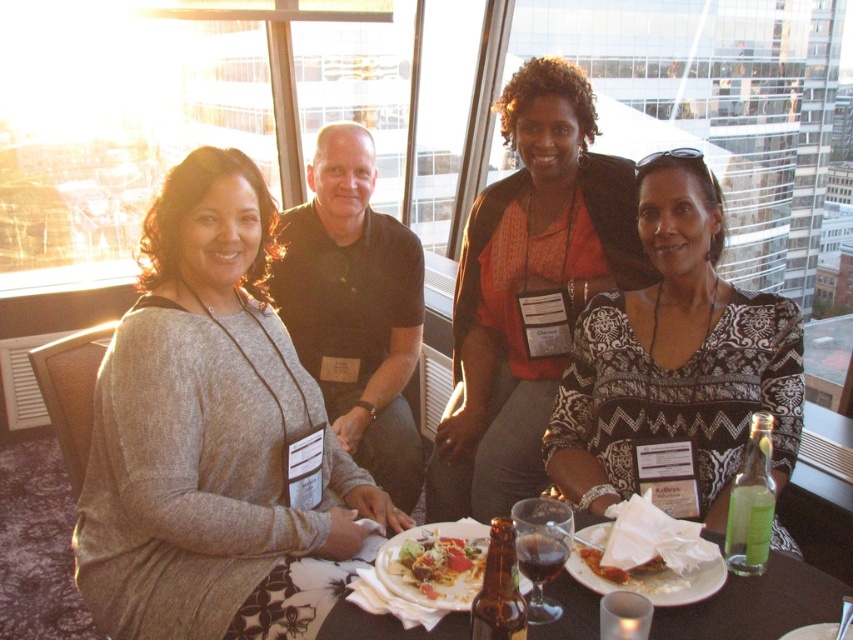
Is translucent glass plate at center positioned before white matte plate at lower right?

Yes, it is in front of white matte plate at lower right.

Does translucent glass plate at center have a lesser width compared to white matte plate at lower right?

→ In fact, translucent glass plate at center might be wider than white matte plate at lower right.

I want to click on translucent glass plate at center, so click(x=755, y=605).

Who is lower down, matte orange blouse at center or white matte plate at lower right?

white matte plate at lower right

Does matte orange blouse at center appear over white matte plate at lower right?

Correct, matte orange blouse at center is located above white matte plate at lower right.

Locate an element on the screen. The width and height of the screenshot is (853, 640). matte orange blouse at center is located at coordinates (527, 288).

I want to click on matte orange blouse at center, so click(x=527, y=288).

Consider the image. Is matte gray sweater at left thinner than black printed blouse at center?

In fact, matte gray sweater at left might be wider than black printed blouse at center.

From the picture: Does matte gray sweater at left have a smaller size compared to black printed blouse at center?

No.

Is point (282, 556) positioned behind point (619, 490)?

No, it is in front of (619, 490).

Where is `matte gray sweater at left`? matte gray sweater at left is located at coordinates (210, 433).